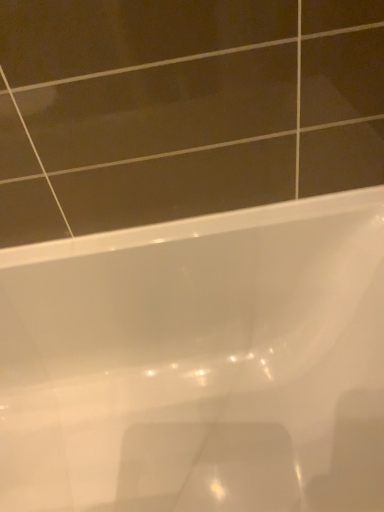
This screenshot has height=512, width=384. What do you see at coordinates (199, 362) in the screenshot? I see `white glossy bathtub at center` at bounding box center [199, 362].

Measure the distance between point (98, 500) and camera.

Point (98, 500) and camera are 84.20 centimeters apart.

Where is `white glossy bathtub at center`? white glossy bathtub at center is located at coordinates (199, 362).

This screenshot has height=512, width=384. Identify the location of white glossy bathtub at center. (199, 362).